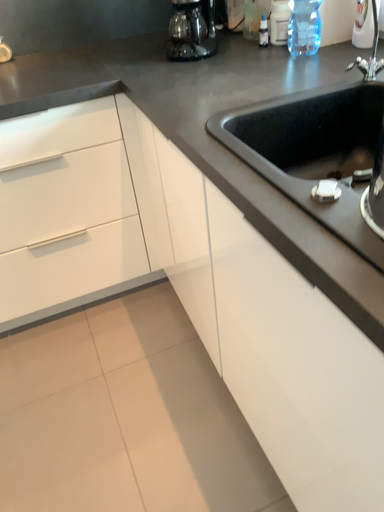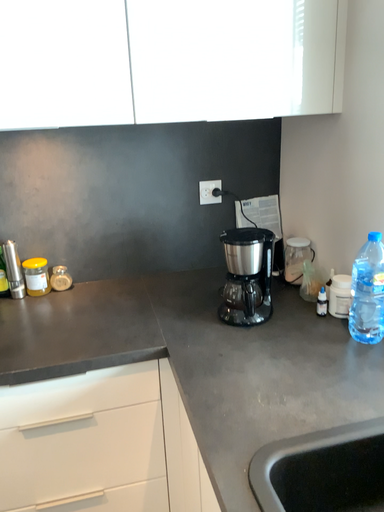
Question: How did the camera likely rotate when shooting the video?

Choices:
 (A) rotated downward
 (B) rotated upward

Answer: (B)